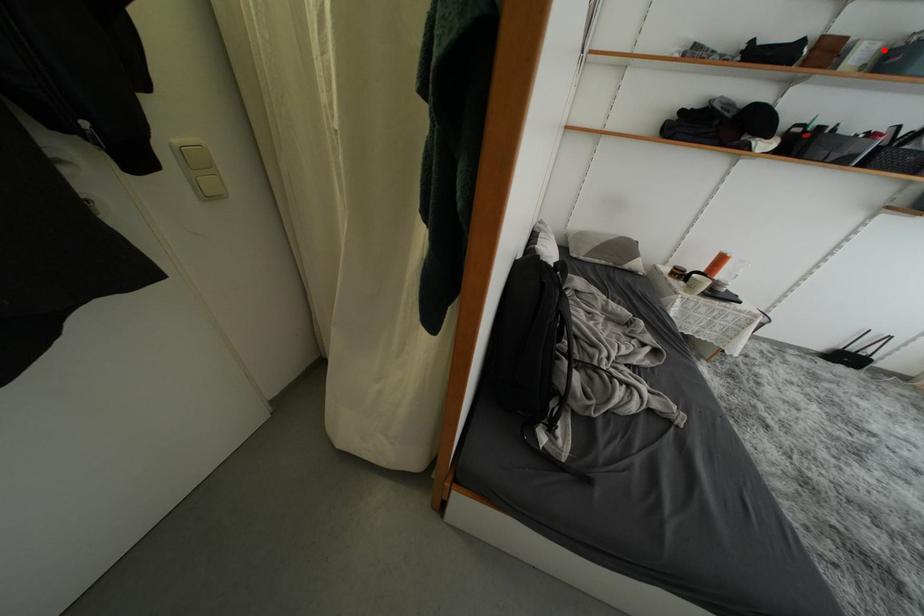
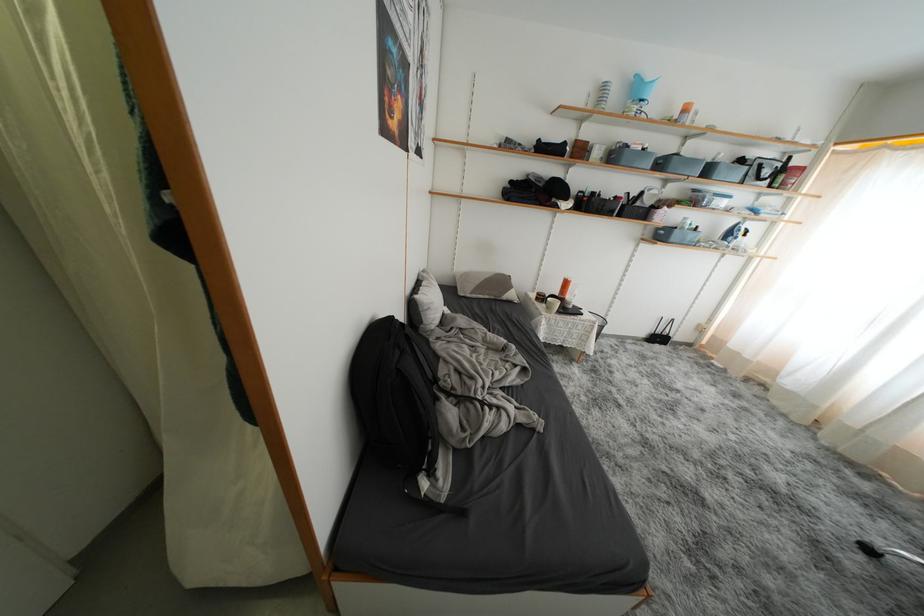
Find the pixel in the second image that matches the highlighted location in the first image.

(610, 152)